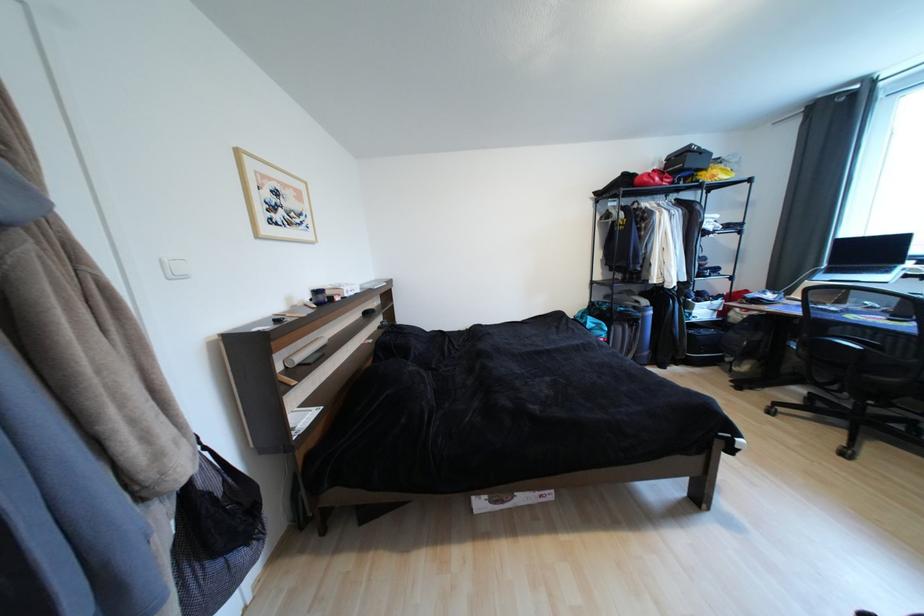
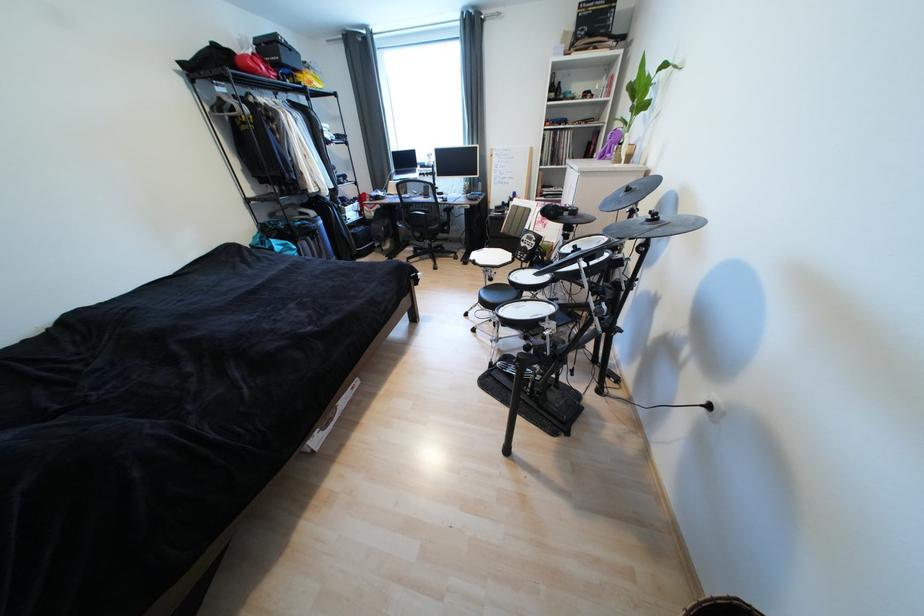
In the second image, find the point that corresponds to point (651, 185) in the first image.

(261, 73)